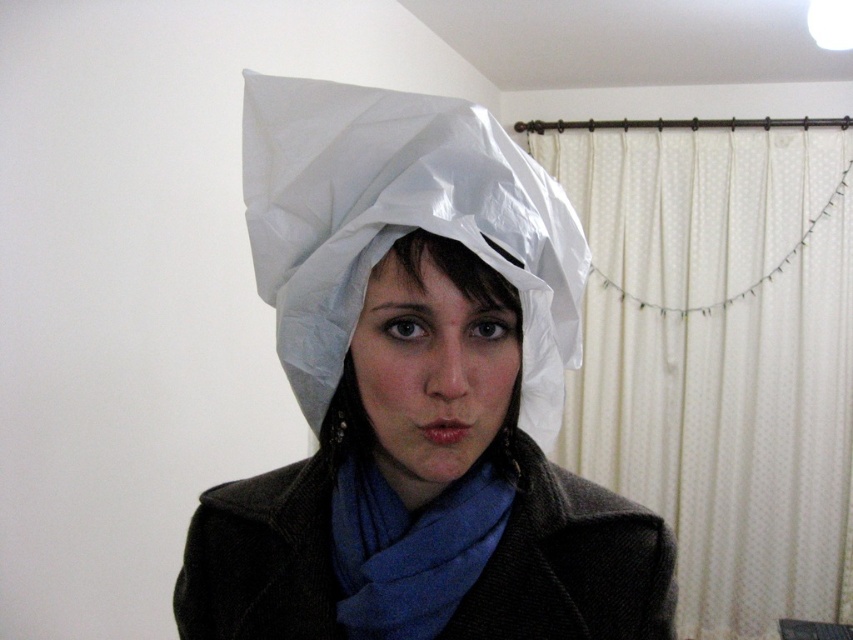
Question: Which of the following is the closest to the observer?

Choices:
 (A) matte white paper hat at center
 (B) white glossy paper hat at center
 (C) white plastic bag at center
 (D) blue soft scarf at center

Answer: (C)

Question: Which point is closer to the camera taking this photo?

Choices:
 (A) (374, 168)
 (B) (492, 477)
 (C) (431, 141)

Answer: (C)

Question: Does white plastic bag at center have a greater width compared to blue soft scarf at center?

Choices:
 (A) no
 (B) yes

Answer: (B)

Question: Is white plastic bag at center bigger than matte white paper hat at center?

Choices:
 (A) yes
 (B) no

Answer: (A)

Question: Does white plastic bag at center lie behind blue soft scarf at center?

Choices:
 (A) yes
 (B) no

Answer: (B)

Question: Which is nearer to the white plastic bag at center?

Choices:
 (A) matte white paper hat at center
 (B) white glossy paper hat at center

Answer: (B)